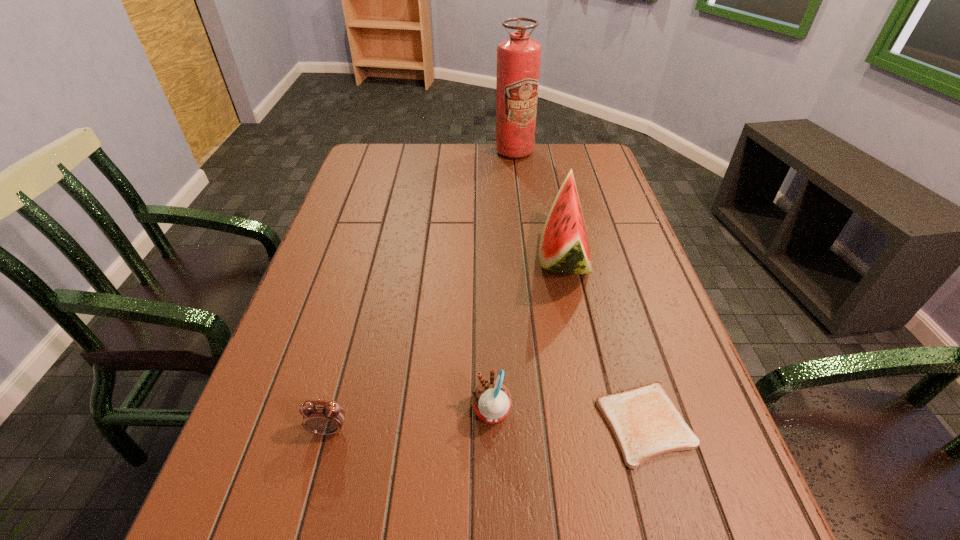
Identify the location of blank area located on the outer rind of the fourth shortest object. This screenshot has height=540, width=960. (516, 256).

At what (x,y) coordinates should I click in order to perform the action: click on vacant space situated on the front-facing side of the muffin. Please return your answer as a coordinate pair (x, y). Image resolution: width=960 pixels, height=540 pixels. Looking at the image, I should click on (311, 412).

This screenshot has width=960, height=540. I want to click on vacant point located on the front-facing side of the muffin, so click(278, 412).

At what (x,y) coordinates should I click in order to perform the action: click on vacant space located 0.310m on the front-facing side of the muffin. Please return your answer as a coordinate pair (x, y). The image size is (960, 540). Looking at the image, I should click on (300, 412).

This screenshot has height=540, width=960. Identify the location of free spot located 0.070m on the face of the leftmost object. (316, 479).

Where is `free space located 0.340m on the left of the toast`? free space located 0.340m on the left of the toast is located at coordinates (408, 424).

Image resolution: width=960 pixels, height=540 pixels. I want to click on object situated at the far edge, so click(518, 58).

Identify the location of object at the left edge. (321, 417).

This screenshot has height=540, width=960. In order to click on watermelon located at the right edge in this screenshot , I will do `click(564, 248)`.

This screenshot has width=960, height=540. I want to click on toast that is at the right edge, so click(646, 423).